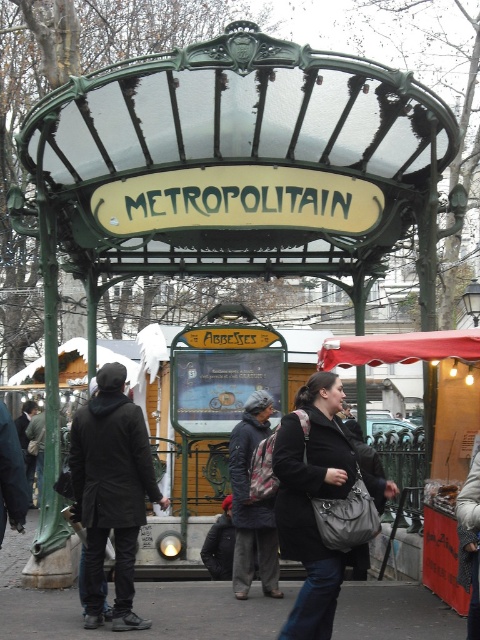
You are a tourist standing in front of the Parisian metro entrance. You see a matte black coat at center and a red fabric canopy at center. Which object is positioned to the left when viewed from your perspective?

The matte black coat at center is to the left of the red fabric canopy at center, so the matte black coat at center is positioned to the left.

You are a tourist standing in front of the Parisian metro entrance. You notice a matte black coat at center and a red fabric canopy at center. Which object is closer to you?

The matte black coat at center is closer to you because it is in front of the red fabric canopy at center.